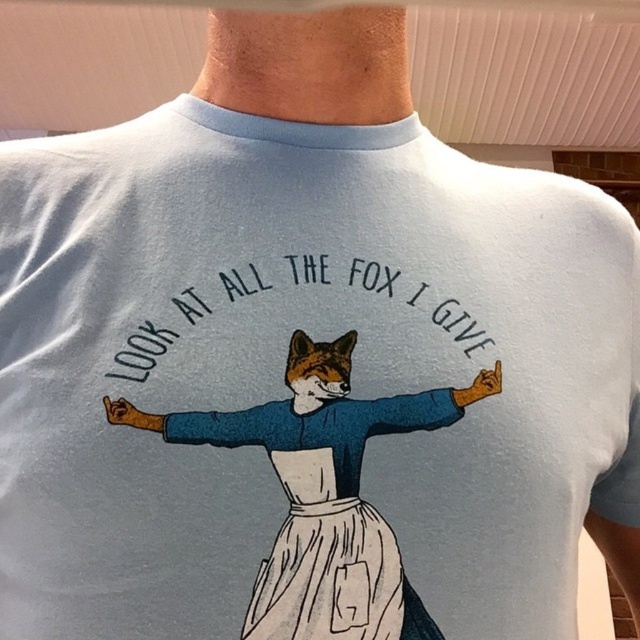
You are a fashion designer looking at a shirt design. The shirt has a white cotton dress at center and a matte blue arm at center. Which one of these two elements is bigger?

The white cotton dress at center is larger in size than the matte blue arm at center, so the white cotton dress at center is bigger.

You are designing a tshirt and want to ensure the fox character on the light blue tshirt has enough space between its two arms. The fox has a blue fabric arm at center and a matte blue arm at center. According to the design, how far apart are these two arms?

The blue fabric arm at center and matte blue arm at center are 2.52 inches apart from each other.

What is the exact coordinate of the blue fabric arm at center?

The blue fabric arm at center is located at point (205, 424).